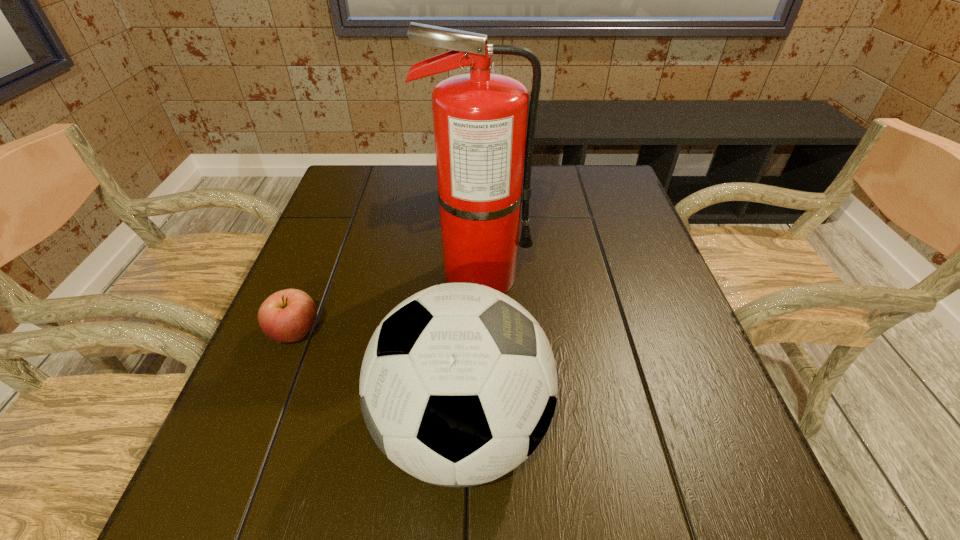
The height and width of the screenshot is (540, 960). I want to click on vacant space at the far right corner, so click(602, 179).

Where is `vacant area at the near right corner`? The width and height of the screenshot is (960, 540). vacant area at the near right corner is located at coordinates (706, 508).

Image resolution: width=960 pixels, height=540 pixels. I want to click on free space between the leftmost object and the farther fire extinguisher, so click(386, 262).

Where is `vacant region between the apple and the farthest object`? The image size is (960, 540). vacant region between the apple and the farthest object is located at coordinates (386, 262).

Where is `vacant space in between the nearer fire extinguisher and the second nearest object`? This screenshot has width=960, height=540. vacant space in between the nearer fire extinguisher and the second nearest object is located at coordinates (387, 303).

Identify the location of free space that is in between the shortest object and the third nearest object. The height and width of the screenshot is (540, 960). (387, 303).

This screenshot has height=540, width=960. In order to click on object that is the second nearest to the leftmost object in this screenshot , I will do tap(480, 118).

This screenshot has width=960, height=540. Find the location of `object that is the closest to the third shortest object`. object that is the closest to the third shortest object is located at coordinates (480, 118).

Identify the location of free spot that satisfies the following two spatial constraints: 1. on the front of the third shortest object near the operation label; 2. on the front side of the shortest object. (476, 332).